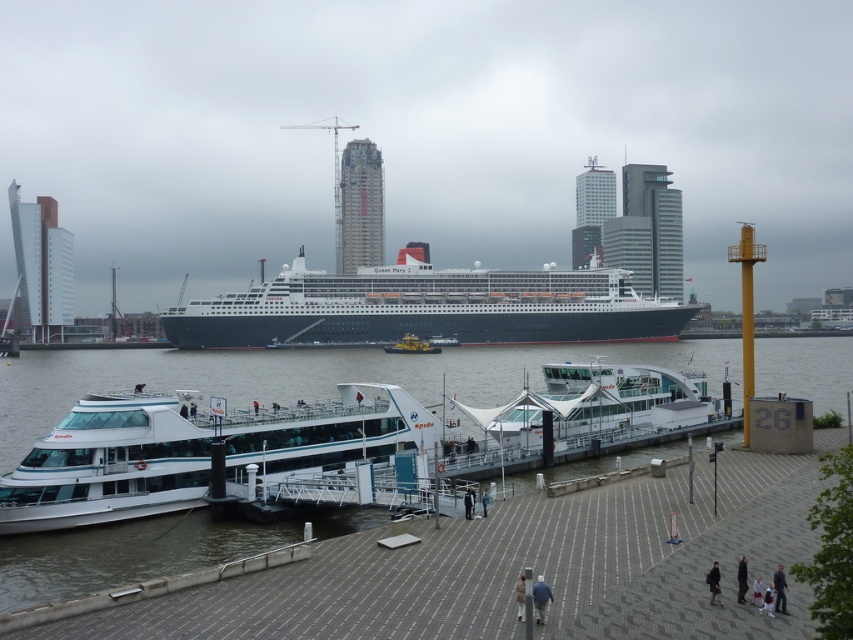
Question: Which point is closer to the camera?

Choices:
 (A) light blue denim jacket at lower center
 (B) dark blue uniform at center
 (C) dark gray fabric jacket at lower right

Answer: (A)

Question: Does white concrete dock at lower center have a greater width compared to white glossy ferry at center?

Choices:
 (A) no
 (B) yes

Answer: (B)

Question: Can you confirm if dark gray fabric jacket at lower right is positioned above light blue fabric jacket at lower center?

Choices:
 (A) yes
 (B) no

Answer: (A)

Question: Which of the following is the farthest from the observer?

Choices:
 (A) (778, 600)
 (B) (482, 502)
 (C) (538, 612)
 (D) (753, 596)

Answer: (B)

Question: Which point is farther to the camera?

Choices:
 (A) pos(514,589)
 (B) pos(219,326)
 (C) pos(775,541)
 (D) pos(770,588)

Answer: (B)

Question: Does dark gray jacket at lower right come in front of light pink fabric pants at lower right?

Choices:
 (A) no
 (B) yes

Answer: (A)